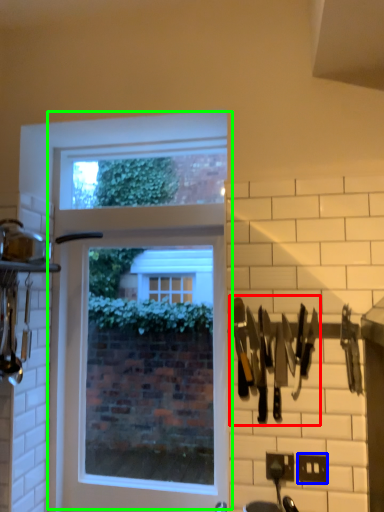
Question: Which is nearer to the cutlery (highlighted by a red box)? electric outlet (highlighted by a blue box) or window (highlighted by a green box).

Choices:
 (A) electric outlet
 (B) window

Answer: (A)